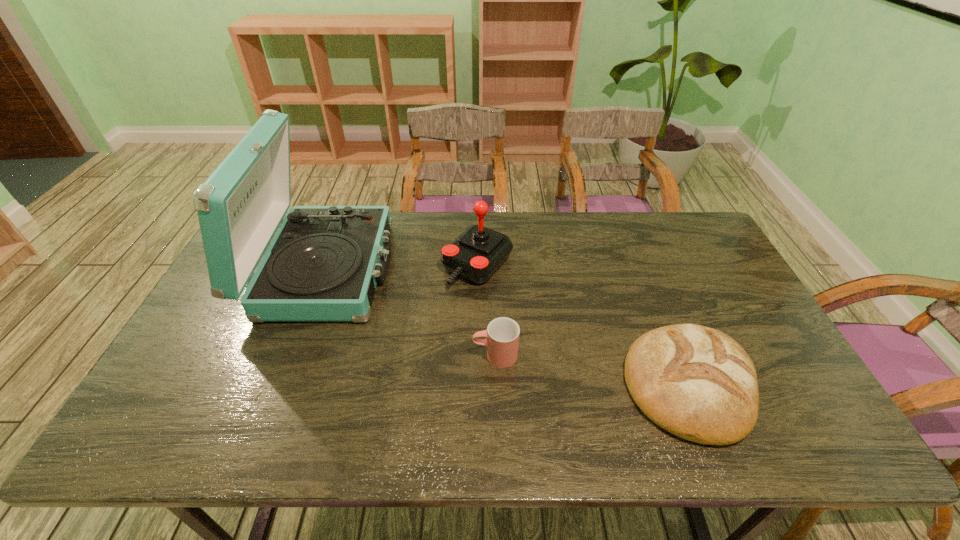
Where is `free location at the left edge`? free location at the left edge is located at coordinates (173, 368).

The width and height of the screenshot is (960, 540). In order to click on vacant region at the far right corner of the desktop in this screenshot , I will do `click(684, 214)`.

Identify the location of free area in between the record player and the cup. (410, 312).

Identify the location of free space between the cup and the joystick. This screenshot has width=960, height=540. (487, 310).

Where is `vacant region between the joystick and the record player`? vacant region between the joystick and the record player is located at coordinates (400, 267).

What are the coordinates of `vacant space that is in between the cup and the bread` in the screenshot? It's located at (592, 370).

At what (x,y) coordinates should I click in order to perform the action: click on vacant region between the rightmost object and the cup. Please return your answer as a coordinate pair (x, y). This screenshot has width=960, height=540. Looking at the image, I should click on (592, 370).

Locate an element on the screen. The image size is (960, 540). vacant space that is in between the joystick and the leftmost object is located at coordinates (400, 267).

You are a GUI agent. You are given a task and a screenshot of the screen. Output one action in this format:
    pyautogui.click(x=<x>, y=<y>)
    Task: Click on the free space between the cup and the tallest object
    This screenshot has height=540, width=960.
    Given the screenshot: What is the action you would take?
    pyautogui.click(x=410, y=312)

Identify the location of unoccupied position between the third shortest object and the record player. This screenshot has height=540, width=960. (400, 267).